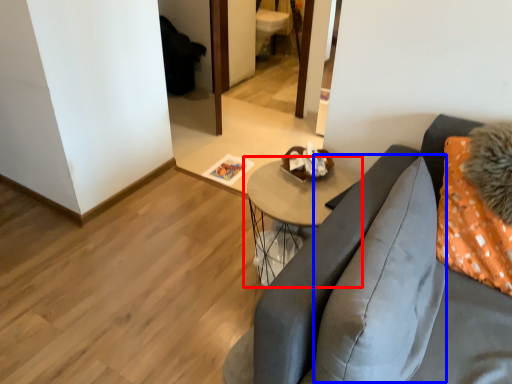
Question: Which of the following is the closest to the observer, table (highlighted by a red box) or pillow (highlighted by a blue box)?

Choices:
 (A) table
 (B) pillow

Answer: (B)